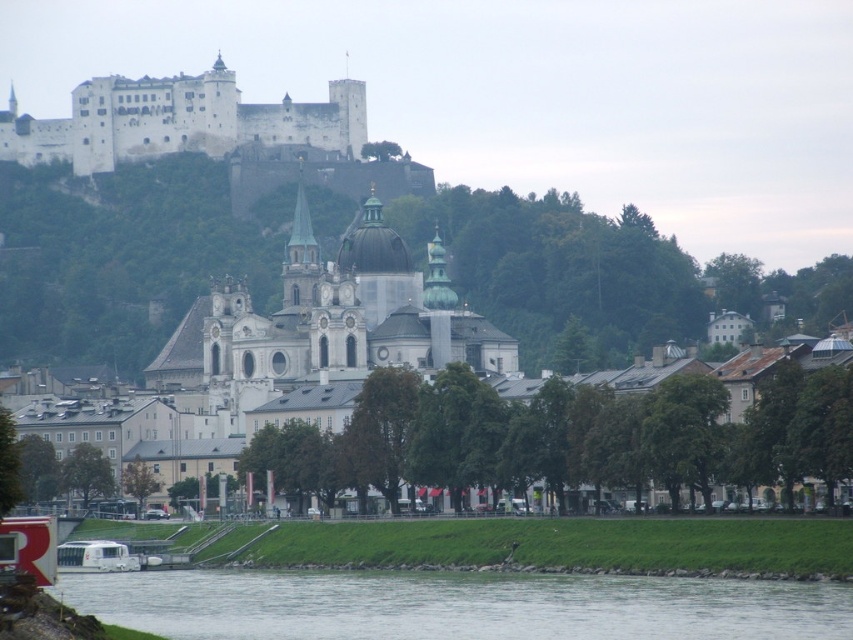
Question: Is clear water at lower center bigger than white stone castle at upper left?

Choices:
 (A) yes
 (B) no

Answer: (B)

Question: Which point appears farthest from the camera in this image?

Choices:
 (A) (163, 625)
 (B) (102, 81)

Answer: (B)

Question: Does clear water at lower center appear under white stone castle at upper left?

Choices:
 (A) yes
 (B) no

Answer: (A)

Question: Is clear water at lower center smaller than white stone castle at upper left?

Choices:
 (A) no
 (B) yes

Answer: (B)